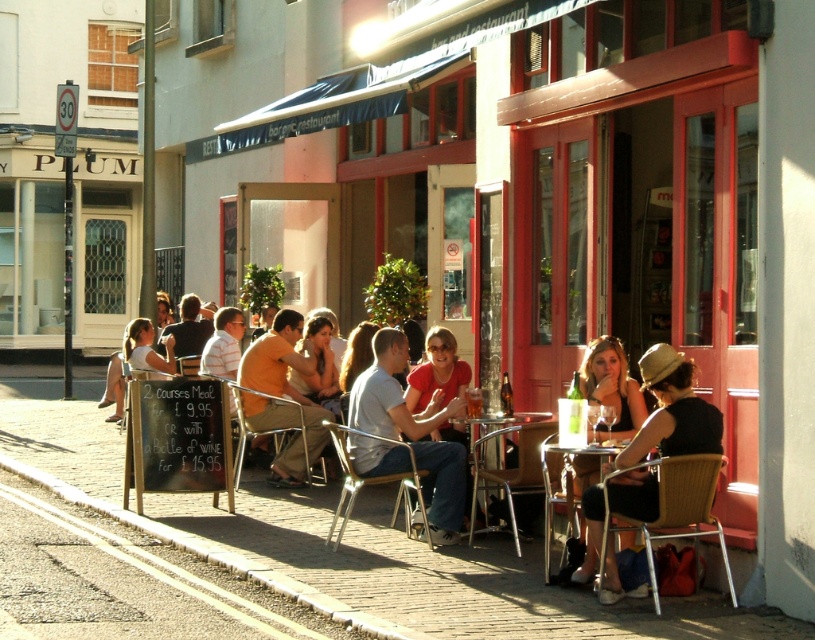
Question: Is matte orange shirt at center above metallic silver table at lower center?

Choices:
 (A) yes
 (B) no

Answer: (A)

Question: Estimate the real-world distances between objects in this image. Which object is farther from the matte black dress at lower right?

Choices:
 (A) translucent glass beer at center
 (B) matte yellow shirt at center
 (C) matte orange shirt at center

Answer: (B)

Question: Which of these objects is positioned farthest from the matte orange shirt at center?

Choices:
 (A) matte black dress at lower right
 (B) metallic silver table at lower center
 (C) translucent glass beer at center
 (D) wooden table at lower right

Answer: (A)

Question: Can you confirm if wooden table at lower right is positioned below translucent glass beer at center?

Choices:
 (A) yes
 (B) no

Answer: (A)

Question: Which point is closer to the camera taking this photo?

Choices:
 (A) (553, 502)
 (B) (293, 358)
 (C) (379, 380)

Answer: (A)

Question: Can you confirm if matte black dress at lower right is bigger than metallic silver table at lower center?

Choices:
 (A) no
 (B) yes

Answer: (B)